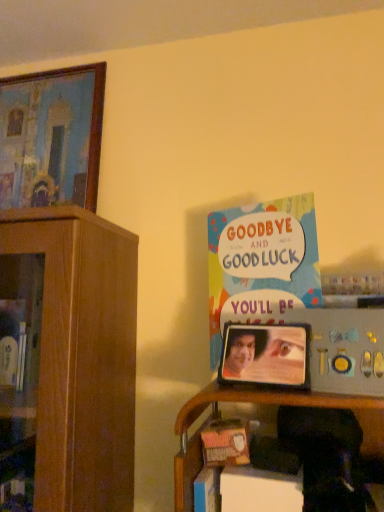
Question: Is wooden shelf at lower right closer to the viewer compared to multicolored paper card at upper right?

Choices:
 (A) no
 (B) yes

Answer: (B)

Question: Is wooden shelf at lower right positioned behind multicolored paper card at upper right?

Choices:
 (A) yes
 (B) no

Answer: (B)

Question: Can you confirm if wooden shelf at lower right is shorter than multicolored paper card at upper right?

Choices:
 (A) yes
 (B) no

Answer: (A)

Question: From a real-world perspective, is wooden shelf at lower right under multicolored paper card at upper right?

Choices:
 (A) no
 (B) yes

Answer: (B)

Question: Is wooden shelf at lower right taller than multicolored paper card at upper right?

Choices:
 (A) no
 (B) yes

Answer: (A)

Question: Is wooden painted picture frame at upper left, marked as the 2th picture frame in a right-to-left arrangement, in front of or behind multicolored paper card at upper right in the image?

Choices:
 (A) behind
 (B) front

Answer: (A)

Question: Is wooden painted picture frame at upper left, which ranks as the 1th picture frame in back-to-front order, taller or shorter than multicolored paper card at upper right?

Choices:
 (A) short
 (B) tall

Answer: (B)

Question: Does point (82, 181) appear closer or farther from the camera than point (319, 279)?

Choices:
 (A) closer
 (B) farther

Answer: (B)

Question: From the image's perspective, is wooden painted picture frame at upper left, which is the second picture frame in bottom-to-top order, above or below multicolored paper card at upper right?

Choices:
 (A) below
 (B) above

Answer: (B)

Question: Would you say multicolored paper card at upper right is inside or outside wooden painted picture frame at upper left, the second picture frame in the front-to-back sequence?

Choices:
 (A) outside
 (B) inside

Answer: (A)

Question: From a real-world perspective, relative to wooden painted picture frame at upper left, the second picture frame in the front-to-back sequence, is multicolored paper card at upper right vertically above or below?

Choices:
 (A) below
 (B) above

Answer: (A)

Question: From the image's perspective, is multicolored paper card at upper right located above or below wooden painted picture frame at upper left, which ranks as the 1th picture frame in back-to-front order?

Choices:
 (A) above
 (B) below

Answer: (B)

Question: Considering the positions of multicolored paper card at upper right and wooden painted picture frame at upper left, marked as the 2th picture frame in a right-to-left arrangement, in the image, is multicolored paper card at upper right wider or thinner than wooden painted picture frame at upper left, marked as the 2th picture frame in a right-to-left arrangement,?

Choices:
 (A) thin
 (B) wide

Answer: (A)

Question: From the image's perspective, relative to wooden shelf at lower right, is wooden painted picture frame at upper left, marked as the 2th picture frame in a right-to-left arrangement, above or below?

Choices:
 (A) below
 (B) above

Answer: (B)

Question: Considering the positions of point (91, 160) and point (177, 505), is point (91, 160) closer or farther from the camera than point (177, 505)?

Choices:
 (A) closer
 (B) farther

Answer: (B)